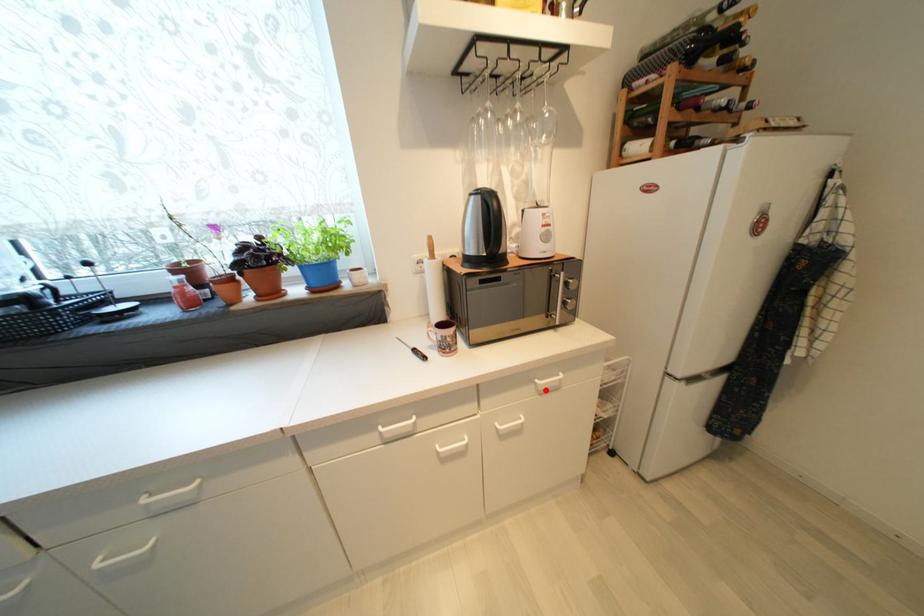
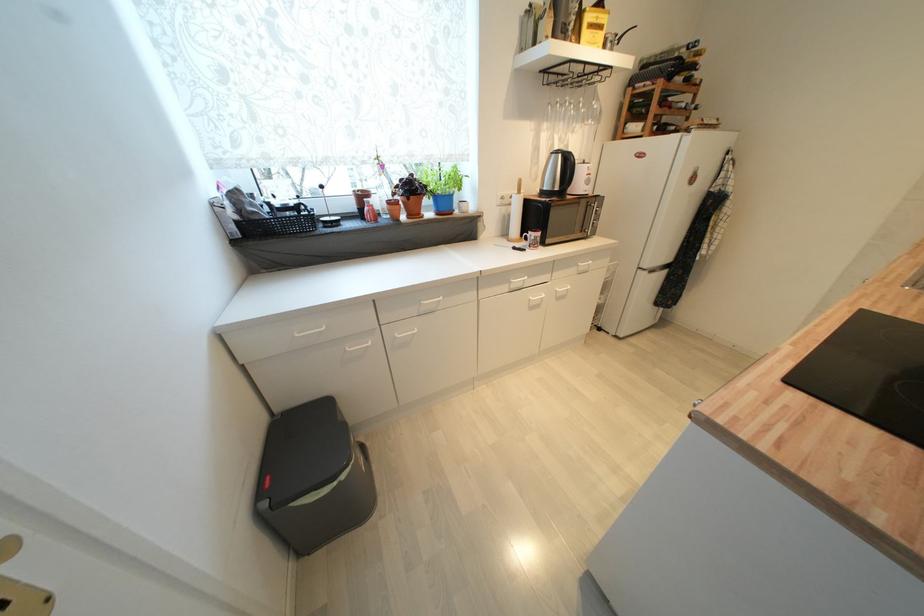
Question: I am providing you with two images of the same scene from different viewpoints. Image1 has a red point marked. In image2, the corresponding 3D location appears at what relative position? Reply with the corresponding letter.

Choices:
 (A) Closer
 (B) Farther

Answer: (A)